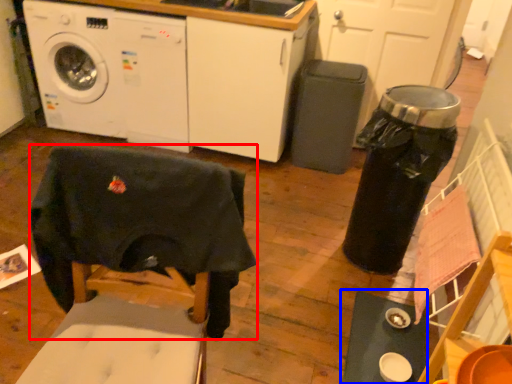
Question: Which object appears closest to the camera in this image, swivel chair (highlighted by a red box) or table (highlighted by a blue box)?

Choices:
 (A) swivel chair
 (B) table

Answer: (A)